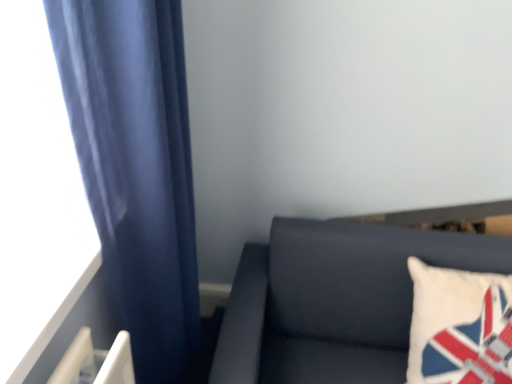
Question: From the image's perspective, would you say satin blue curtain at left is shown under dark gray fabric couch at lower right?

Choices:
 (A) yes
 (B) no

Answer: (B)

Question: Is the position of satin blue curtain at left less distant than that of dark gray fabric couch at lower right?

Choices:
 (A) no
 (B) yes

Answer: (B)

Question: Is satin blue curtain at left not close to dark gray fabric couch at lower right?

Choices:
 (A) yes
 (B) no

Answer: (B)

Question: From a real-world perspective, is satin blue curtain at left located higher than dark gray fabric couch at lower right?

Choices:
 (A) yes
 (B) no

Answer: (A)

Question: From a real-world perspective, is satin blue curtain at left located beneath dark gray fabric couch at lower right?

Choices:
 (A) no
 (B) yes

Answer: (A)

Question: Is satin blue curtain at left facing away from dark gray fabric couch at lower right?

Choices:
 (A) no
 (B) yes

Answer: (A)

Question: Is satin blue curtain at left smaller than white fabric pillow at right?

Choices:
 (A) yes
 (B) no

Answer: (B)

Question: Does satin blue curtain at left have a lesser width compared to white fabric pillow at right?

Choices:
 (A) yes
 (B) no

Answer: (A)

Question: Is satin blue curtain at left aimed at white fabric pillow at right?

Choices:
 (A) no
 (B) yes

Answer: (B)

Question: Considering the relative sizes of satin blue curtain at left and white fabric pillow at right in the image provided, is satin blue curtain at left wider than white fabric pillow at right?

Choices:
 (A) no
 (B) yes

Answer: (A)

Question: Are satin blue curtain at left and white fabric pillow at right beside each other?

Choices:
 (A) no
 (B) yes

Answer: (A)

Question: Is satin blue curtain at left outside white fabric pillow at right?

Choices:
 (A) no
 (B) yes

Answer: (B)

Question: Is dark gray fabric couch at lower right oriented away from white fabric pillow at right?

Choices:
 (A) no
 (B) yes

Answer: (B)